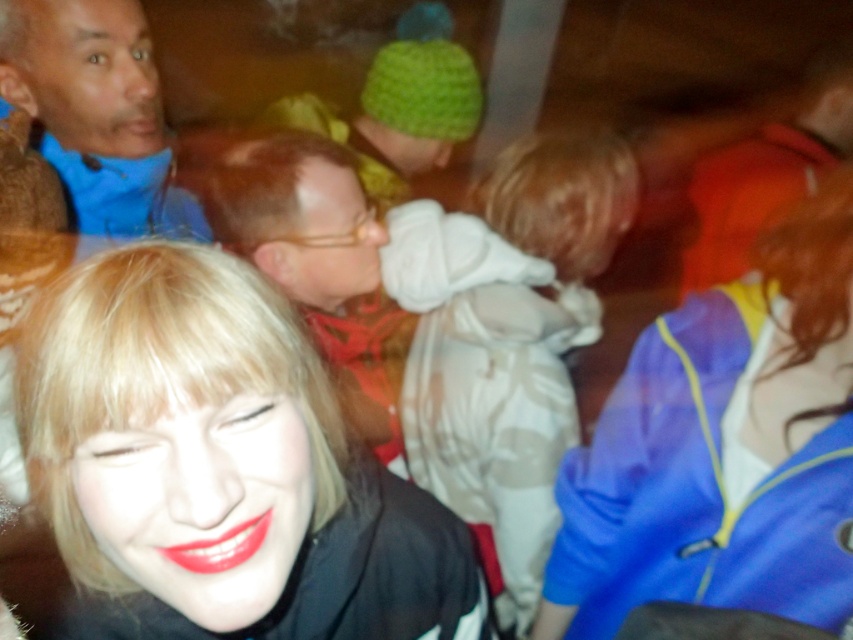
Is shiny black jacket at lower left taller than white cotton hoodie at center?

In fact, shiny black jacket at lower left may be shorter than white cotton hoodie at center.

Is point (438, 576) behind point (511, 573)?

No, (438, 576) is in front of (511, 573).

Identify the location of shiny black jacket at lower left. Image resolution: width=853 pixels, height=640 pixels. (213, 458).

Does shiny black jacket at lower left appear under blue fleece jacket at upper left?

Correct, shiny black jacket at lower left is located below blue fleece jacket at upper left.

Who is more forward, (328, 394) or (144, 33)?

Point (328, 394) is in front.

You are a GUI agent. You are given a task and a screenshot of the screen. Output one action in this format:
    pyautogui.click(x=<x>, y=<y>)
    Task: Click on the shiny black jacket at lower left
    
    Given the screenshot: What is the action you would take?
    pyautogui.click(x=213, y=458)

The width and height of the screenshot is (853, 640). Find the location of `shiny black jacket at lower left`. shiny black jacket at lower left is located at coordinates (213, 458).

Does blue fabric jacket at right appear under blue fleece jacket at upper left?

Yes, blue fabric jacket at right is below blue fleece jacket at upper left.

This screenshot has width=853, height=640. Identify the location of blue fabric jacket at right. (724, 448).

What do you see at coordinates (724, 448) in the screenshot?
I see `blue fabric jacket at right` at bounding box center [724, 448].

Locate an element on the screen. The image size is (853, 640). blue fabric jacket at right is located at coordinates (724, 448).